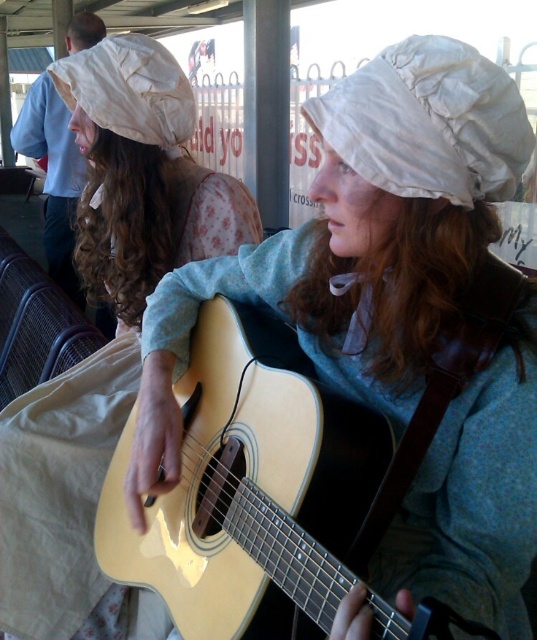
You are standing 1.2 meters away from the covered structure where the two individuals are seated. You want to move to the point at coordinates point (x=317, y=301). Will you be able to reach that point without moving closer than 1 meter to the individuals?

The distance of point (x=317, y=301) from viewer is 1.03 meters. Since you are currently 1.2 meters away and want to move to a point only 1.03 meters away, you will be getting closer than 1 meter to the individuals, so you cannot reach that point without violating the 1 meter distance requirement.

Looking at this image, you are standing in front of the scene and want to know which of the two points, point (x=357, y=90) or point (x=12, y=422), is nearer to you. Can you determine this based on their positions?

Point (x=357, y=90) is closer to the viewer than point (x=12, y=422).

Looking at this image, you are setting up a display stand that can only accommodate items up to 40 cm in width. You need to place either the light wood acoustic guitar at center or the white fabric hat at upper left. Based on their widths, which item can fit on the stand?

The light wood acoustic guitar at center might be wider than white fabric hat at upper left. Since the stand can only hold items up to 40 cm, the white fabric hat at upper left is more likely to fit.